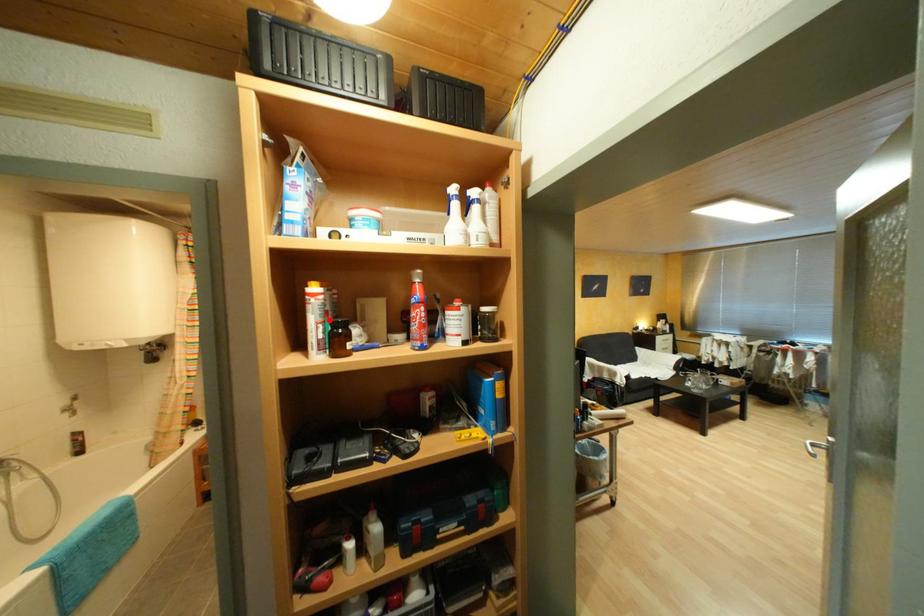
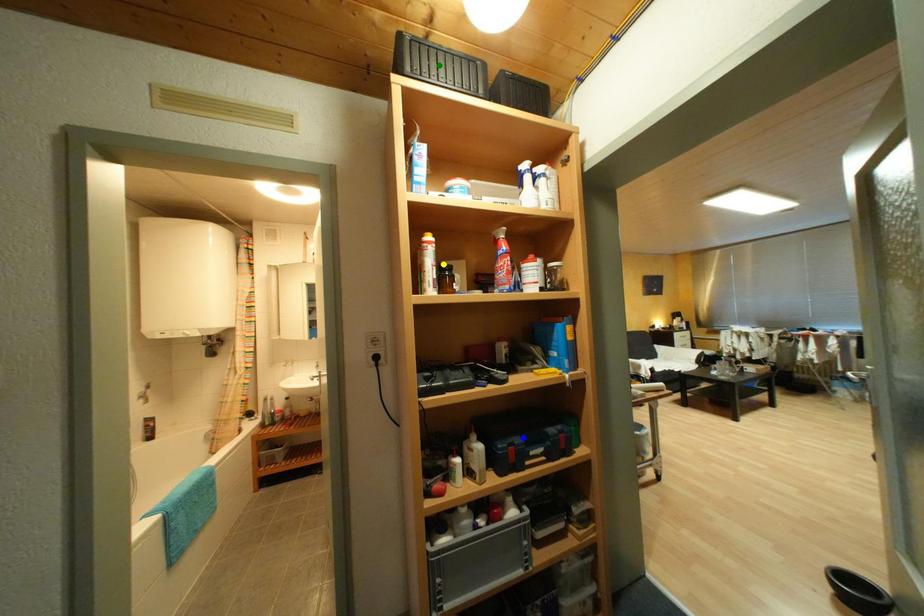
Question: I am providing you with two images of the same scene from different viewpoints. A red point is marked on the first image. You are given multiple points on the second image. Which spot in image 2 lines up with the point in image 1?

Choices:
 (A) blue point
 (B) yellow point
 (C) green point

Answer: (B)